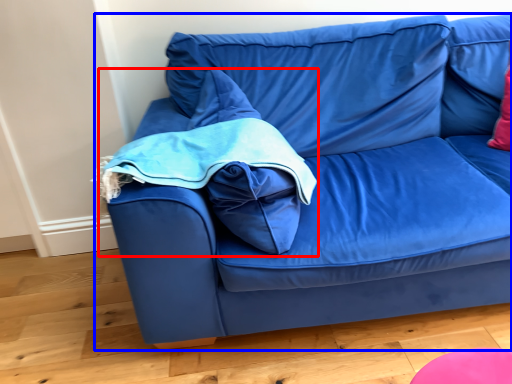
Question: Which object is closer to the camera taking this photo, bean bag chair (highlighted by a red box) or studio couch (highlighted by a blue box)?

Choices:
 (A) bean bag chair
 (B) studio couch

Answer: (B)